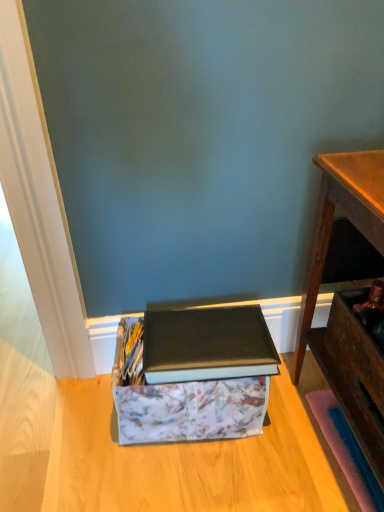
Question: Is wooden drawer at lower right smaller than floral fabric storage box at lower center?

Choices:
 (A) no
 (B) yes

Answer: (B)

Question: Does wooden drawer at lower right have a greater height compared to floral fabric storage box at lower center?

Choices:
 (A) no
 (B) yes

Answer: (B)

Question: From a real-world perspective, is wooden drawer at lower right physically below floral fabric storage box at lower center?

Choices:
 (A) no
 (B) yes

Answer: (A)

Question: From a real-world perspective, does wooden drawer at lower right stand above floral fabric storage box at lower center?

Choices:
 (A) no
 (B) yes

Answer: (B)

Question: Does wooden drawer at lower right have a larger size compared to floral fabric storage box at lower center?

Choices:
 (A) yes
 (B) no

Answer: (B)

Question: In terms of width, does floral fabric storage box at lower center look wider or thinner when compared to wooden desk at right?

Choices:
 (A) wide
 (B) thin

Answer: (B)

Question: Is floral fabric storage box at lower center spatially inside wooden desk at right, or outside of it?

Choices:
 (A) outside
 (B) inside

Answer: (A)

Question: From the image's perspective, is floral fabric storage box at lower center located above or below wooden desk at right?

Choices:
 (A) above
 (B) below

Answer: (B)

Question: Considering the relative positions of floral fabric storage box at lower center and wooden desk at right in the image provided, is floral fabric storage box at lower center to the left or to the right of wooden desk at right?

Choices:
 (A) right
 (B) left

Answer: (B)

Question: From the image's perspective, is matte black book at center above or below wooden drawer at lower right?

Choices:
 (A) above
 (B) below

Answer: (B)

Question: Looking at their shapes, would you say matte black book at center is wider or thinner than wooden drawer at lower right?

Choices:
 (A) thin
 (B) wide

Answer: (B)

Question: In terms of height, does matte black book at center look taller or shorter compared to wooden drawer at lower right?

Choices:
 (A) tall
 (B) short

Answer: (B)

Question: Would you say matte black book at center is to the left or to the right of wooden drawer at lower right in the picture?

Choices:
 (A) left
 (B) right

Answer: (A)

Question: Is wooden drawer at lower right in front of or behind floral fabric storage box at lower center in the image?

Choices:
 (A) behind
 (B) front

Answer: (B)

Question: In terms of height, does wooden drawer at lower right look taller or shorter compared to floral fabric storage box at lower center?

Choices:
 (A) short
 (B) tall

Answer: (B)